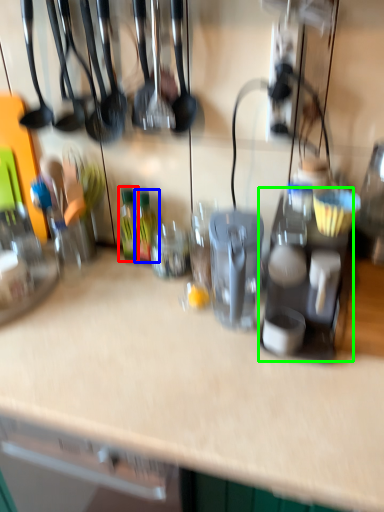
Question: Based on their relative distances, which object is nearer to bottle (highlighted by a red box)? Choose from bottle (highlighted by a blue box) and appliance (highlighted by a green box).

Choices:
 (A) bottle
 (B) appliance

Answer: (A)